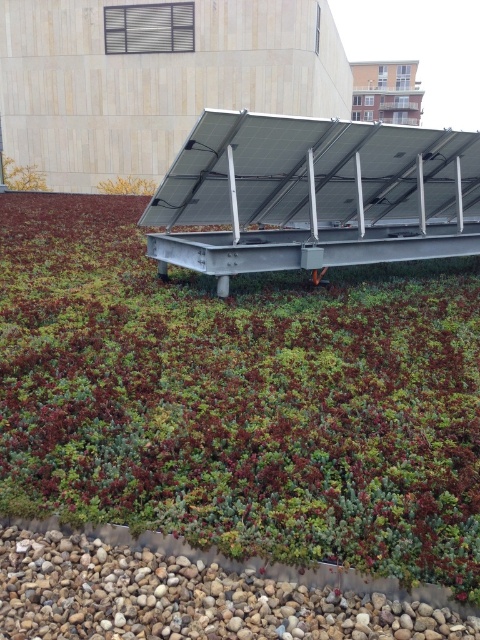
You are a maintenance worker inspecting the green roof. You notice the transparent glass solar panel at upper center and the yellow leafy plant at upper left. Which object is closer to you when standing on the roof?

The transparent glass solar panel at upper center is closer to you because it is in front of the yellow leafy plant at upper left.

You are standing 2 meters away from the edge of the green roof. You want to reach the green succulent at center without stepping on the solar panel system. Is it possible?

The green succulent at center is 2.12 meters away from the viewer. Since you are already 2 meters away from the edge, you can reach the green succulent at center by moving forward 0.12 meters without needing to step onto the solar panel system.

You are standing on the green roof and want to place a new solar panel. The existing solar panel system is mounted on a metal frame at the center. There is a point at coordinates (240, 397) on the roof. What is located at this point?

The point at coordinates (240, 397) corresponds to a green succulent at center.